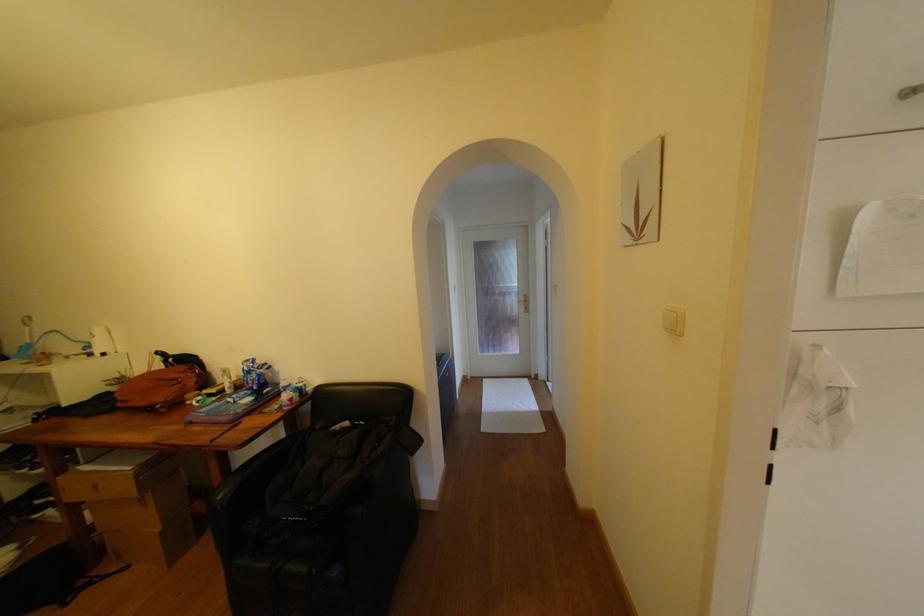
I want to click on white light switch, so click(673, 320).